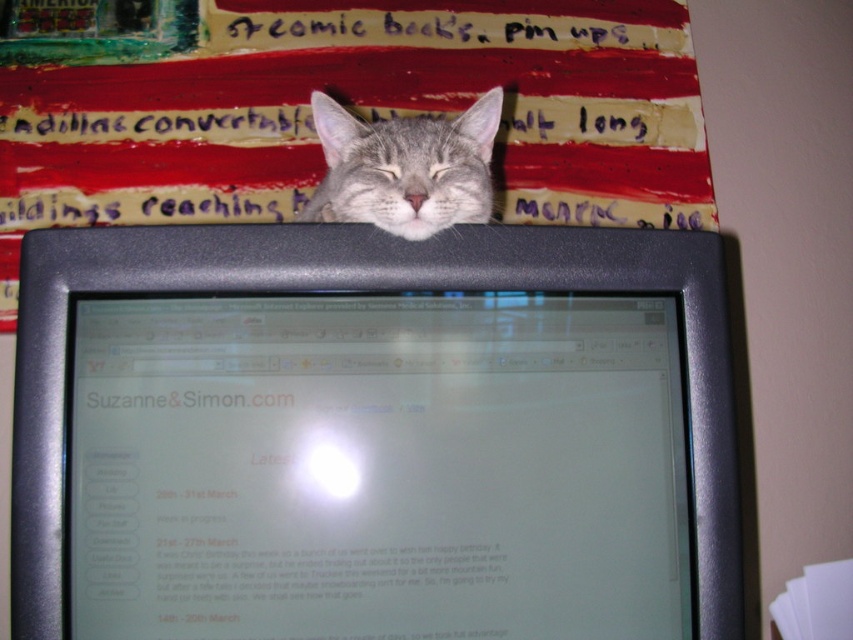
You are a photographer who needs to capture a clear photo of the matte black monitor at center. The camera you are using has a minimum focusing distance of 60 centimeters. Can you take a clear photo without moving the camera closer?

The matte black monitor at center is 57.05 centimeters away from the camera, which is less than the minimum focusing distance of 60 centimeters. Therefore, the camera cannot focus clearly on the matte black monitor at center from this distance.